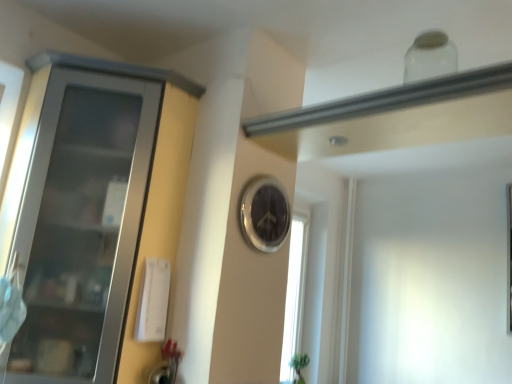
Measure the distance between point [164,113] and camera.

Point [164,113] and camera are 1.61 meters apart from each other.

Describe the element at coordinates (92, 215) in the screenshot. Image resolution: width=512 pixels, height=384 pixels. I see `matte gray cabinet at left` at that location.

Identify the location of matte gray cabinet at left. This screenshot has width=512, height=384. (92, 215).

What is the approximate height of matte gray cabinet at left?

It is 3.97 feet.

What do you see at coordinates (264, 213) in the screenshot? I see `metallic silver clock at center` at bounding box center [264, 213].

The height and width of the screenshot is (384, 512). I want to click on metallic silver clock at center, so click(264, 213).

The image size is (512, 384). I want to click on matte gray cabinet at left, so click(92, 215).

Based on their positions, is metallic silver clock at center located to the left or right of matte gray cabinet at left?

Based on their positions, metallic silver clock at center is located to the right of matte gray cabinet at left.

Between metallic silver clock at center and matte gray cabinet at left, which one is positioned in front?

matte gray cabinet at left is more forward.

Is point (240, 208) less distant than point (58, 142)?

Yes, point (240, 208) is in front of point (58, 142).

Consider the image. From the image's perspective, which one is positioned higher, metallic silver clock at center or matte gray cabinet at left?

metallic silver clock at center, from the image's perspective.

From a real-world perspective, is metallic silver clock at center physically located above or below matte gray cabinet at left?

metallic silver clock at center is situated higher than matte gray cabinet at left in the real world.

Looking at their sizes, would you say metallic silver clock at center is wider or thinner than matte gray cabinet at left?

Considering their sizes, metallic silver clock at center looks slimmer than matte gray cabinet at left.

Can you confirm if metallic silver clock at center is taller than matte gray cabinet at left?

In fact, metallic silver clock at center may be shorter than matte gray cabinet at left.

Can you confirm if metallic silver clock at center is bigger than matte gray cabinet at left?

Incorrect, metallic silver clock at center is not larger than matte gray cabinet at left.

Does metallic silver clock at center contain matte gray cabinet at left?

No.

Are metallic silver clock at center and matte gray cabinet at left far apart?

That's not correct — metallic silver clock at center is a little close to matte gray cabinet at left.

Consider the image. Is metallic silver clock at center aimed at matte gray cabinet at left?

No, metallic silver clock at center is not facing towards matte gray cabinet at left.

You are a GUI agent. You are given a task and a screenshot of the screen. Output one action in this format:
    pyautogui.click(x=<x>, y=<y>)
    Task: Click on the cupboard lying below the metallic silver clock at center (from the image's perspective)
    
    Given the screenshot: What is the action you would take?
    pyautogui.click(x=92, y=215)

Can you confirm if matte gray cabinet at left is positioned to the right of metallic silver clock at center?

No.

Considering the positions of objects matte gray cabinet at left and metallic silver clock at center in the image provided, who is behind, matte gray cabinet at left or metallic silver clock at center?

metallic silver clock at center is further away from the camera.

Is point (72, 173) behind point (288, 205)?

That is False.

From the image's perspective, is matte gray cabinet at left under metallic silver clock at center?

Correct, matte gray cabinet at left appears lower than metallic silver clock at center in the image.

From a real-world perspective, is matte gray cabinet at left beneath metallic silver clock at center?

Correct, in the physical world, matte gray cabinet at left is lower than metallic silver clock at center.

Considering the sizes of objects matte gray cabinet at left and metallic silver clock at center in the image provided, who is thinner, matte gray cabinet at left or metallic silver clock at center?

With smaller width is metallic silver clock at center.

Considering the sizes of matte gray cabinet at left and metallic silver clock at center in the image, is matte gray cabinet at left taller or shorter than metallic silver clock at center?

matte gray cabinet at left is taller than metallic silver clock at center.

Does matte gray cabinet at left have a smaller size compared to metallic silver clock at center?

Actually, matte gray cabinet at left might be larger than metallic silver clock at center.

Would you say matte gray cabinet at left is outside metallic silver clock at center?

Yes, matte gray cabinet at left is located beyond the bounds of metallic silver clock at center.

Is matte gray cabinet at left in contact with metallic silver clock at center?

There is a gap between matte gray cabinet at left and metallic silver clock at center.

Is matte gray cabinet at left facing towards metallic silver clock at center?

No, matte gray cabinet at left does not turn towards metallic silver clock at center.

Locate an element on the screen. The height and width of the screenshot is (384, 512). clock located above the matte gray cabinet at left (from the image's perspective) is located at coordinates (264, 213).

Locate an element on the screen. cupboard on the left of metallic silver clock at center is located at coordinates [92, 215].

I want to click on clock above the matte gray cabinet at left (from a real-world perspective), so click(x=264, y=213).